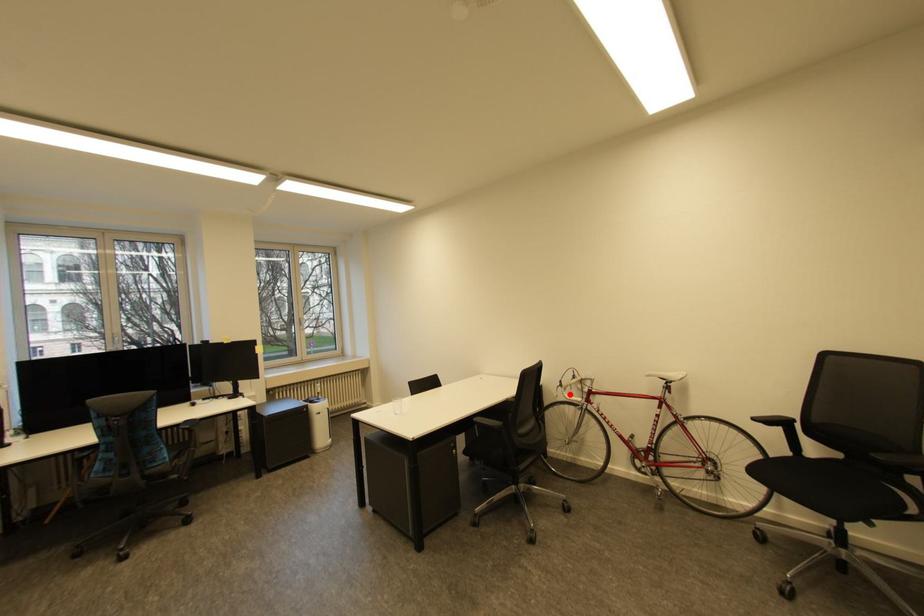
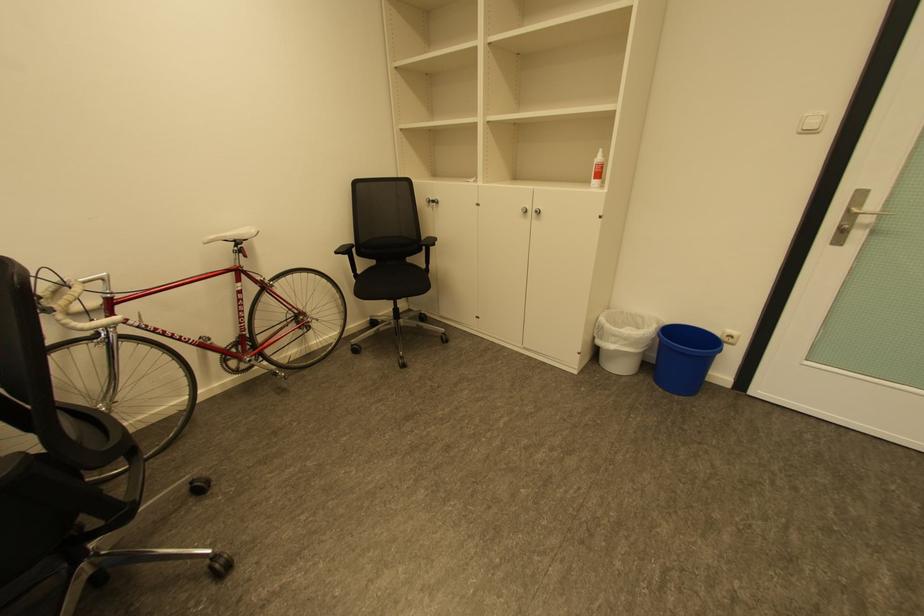
Question: I am providing you with two images of the same scene from different viewpoints. A red point is shown in image1. For the corresponding object point in image2, is it positioned nearer or farther from the camera?

Choices:
 (A) Nearer
 (B) Farther

Answer: (A)